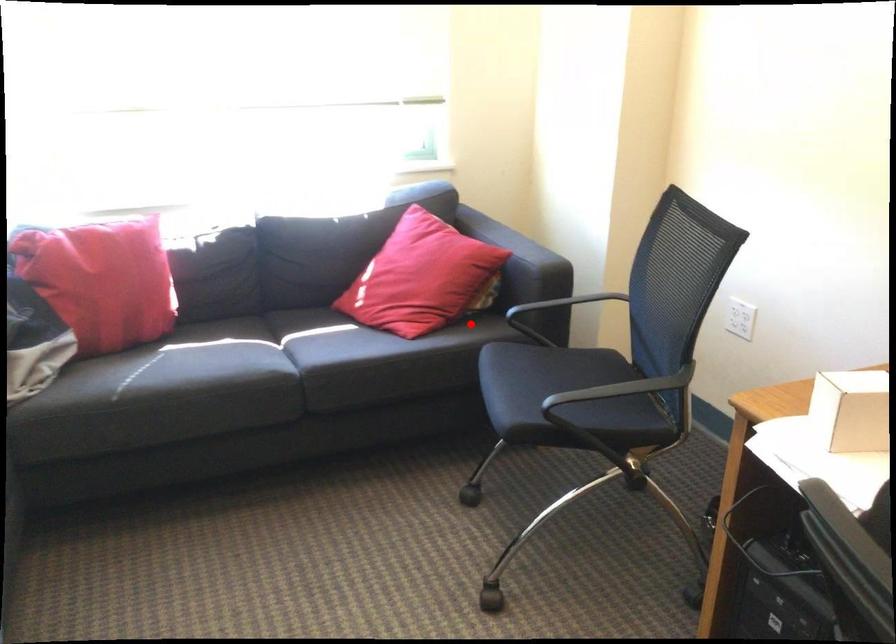
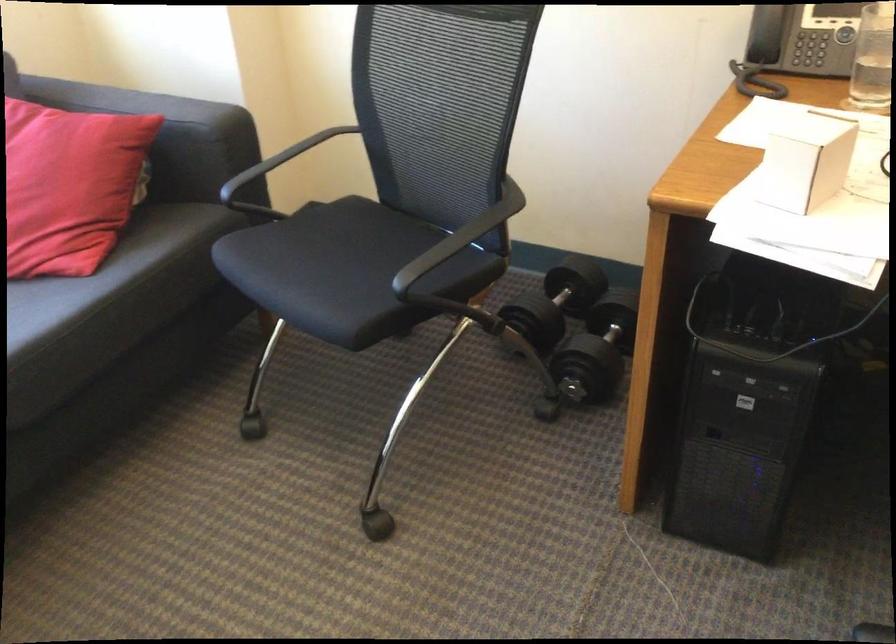
Question: I am providing you with two images of the same scene from different viewpoints. A red point is shown in image1. For the corresponding object point in image2, is it positioned nearer or farther from the camera?

Choices:
 (A) Nearer
 (B) Farther

Answer: (A)